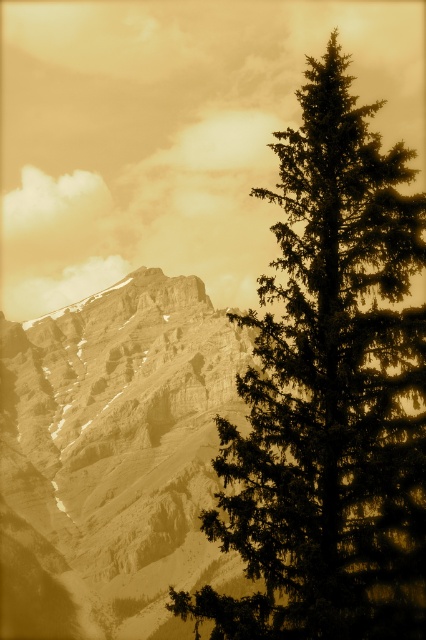
Looking at this image, you are an artist painting this scene. You want to ensure the green textured pine tree at right and the sepia textured mountain range at left are proportionally accurate. Which object should be drawn smaller in size?

The green textured pine tree at right should be drawn smaller than the sepia textured mountain range at left since the description states that the pine tree is not as tall as the mountain range.

You are a hiker planning to take a photo of the green textured pine tree at right and the sepia textured mountain range at left from a distance. If your camera can focus on objects up to 400 feet away, will both subjects be in focus?

The green textured pine tree at right is 367.04 feet from the sepia textured mountain range at left. Since the camera can focus up to 400 feet, both subjects will be within the focus range and thus in focus.